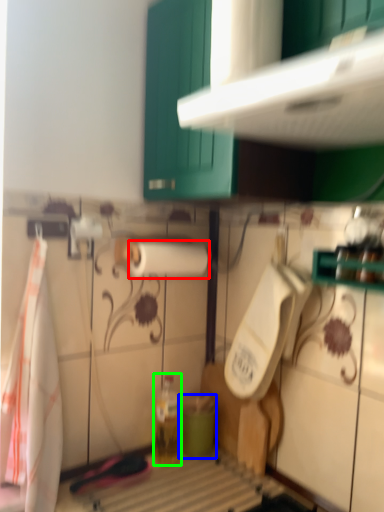
Question: Estimate the real-world distances between objects in this image. Which object is closer to paper towel (highlighted by a red box), teal (highlighted by a blue box) or bottle (highlighted by a green box)?

Choices:
 (A) teal
 (B) bottle

Answer: (B)